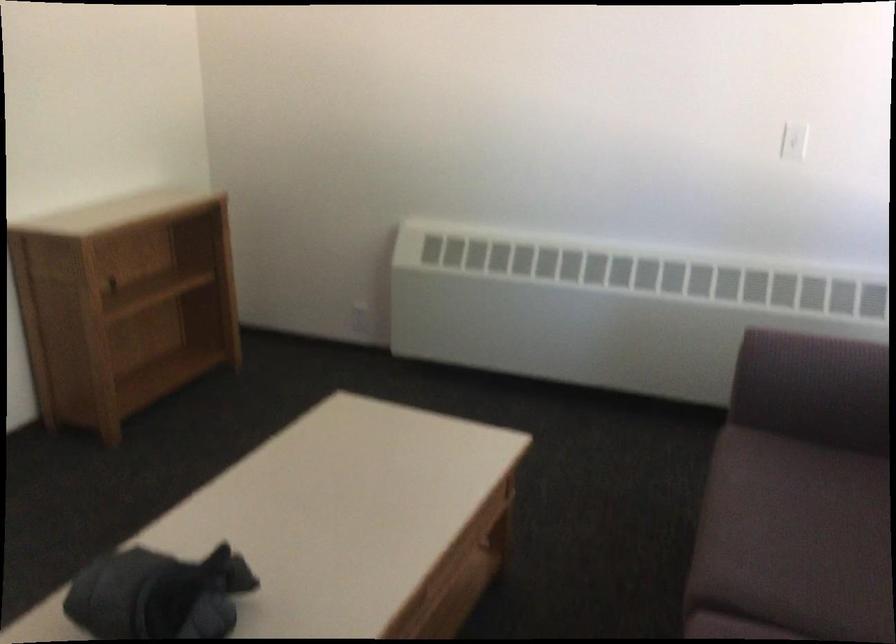
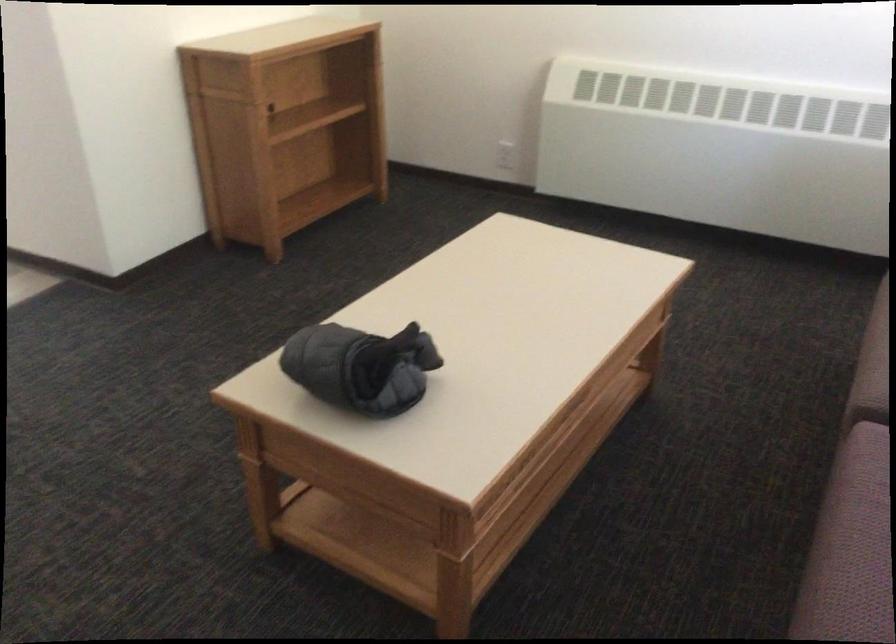
What movement of the cameraman would produce the second image?

The cameraman moved toward left, backward.